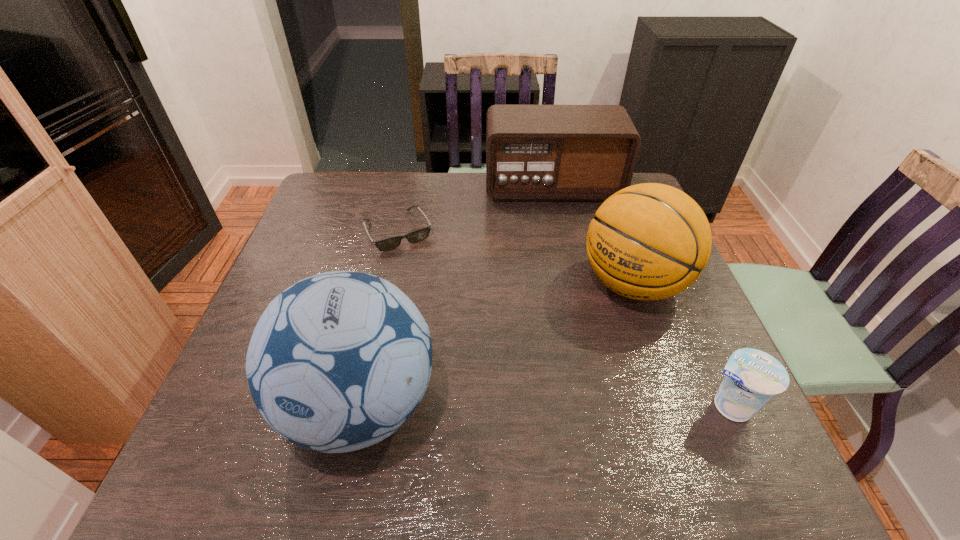
The height and width of the screenshot is (540, 960). Identify the location of soccer ball. click(x=337, y=362).

This screenshot has width=960, height=540. Identify the location of yogurt. (752, 377).

The height and width of the screenshot is (540, 960). I want to click on basketball, so click(x=650, y=241).

In order to click on sunglasses in this screenshot , I will do `click(390, 243)`.

You are a GUI agent. You are given a task and a screenshot of the screen. Output one action in this format:
    pyautogui.click(x=<x>, y=<y>)
    Task: Click on the radio receiver
    Image resolution: width=960 pixels, height=540 pixels.
    Given the screenshot: What is the action you would take?
    pyautogui.click(x=533, y=152)

At what (x,y) coordinates should I click in order to perform the action: click on the third shortest object. Please return your answer as a coordinate pair (x, y). The image size is (960, 540). Looking at the image, I should click on (533, 152).

The height and width of the screenshot is (540, 960). In order to click on free region located on the left of the fourth tallest object in this screenshot , I will do `click(575, 406)`.

Find the location of `vacant space located 0.320m on the surface of the basketball near the brand logo`. vacant space located 0.320m on the surface of the basketball near the brand logo is located at coordinates (505, 395).

Find the location of `vacant area located 0.050m on the surface of the basketball near the brand logo`. vacant area located 0.050m on the surface of the basketball near the brand logo is located at coordinates click(x=588, y=322).

Locate an element on the screen. free spot located on the surface of the basketball near the brand logo is located at coordinates (548, 357).